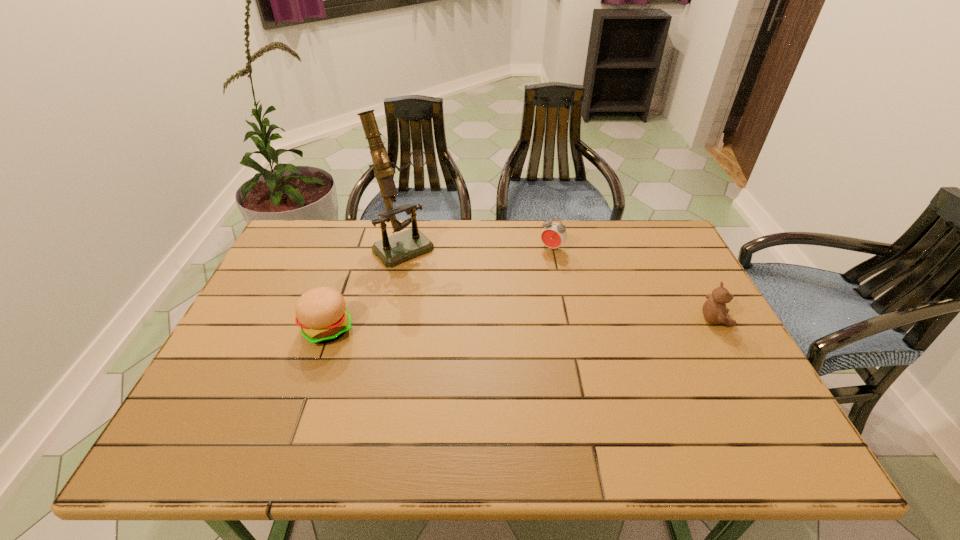
Where is `vacant space that's between the rightmost object and the second object from right to left`? vacant space that's between the rightmost object and the second object from right to left is located at coordinates (635, 284).

You are a GUI agent. You are given a task and a screenshot of the screen. Output one action in this format:
    pyautogui.click(x=<x>, y=<y>)
    Task: Click on the free area in between the microscope and the hamburger
    The height and width of the screenshot is (540, 960).
    Given the screenshot: What is the action you would take?
    pyautogui.click(x=366, y=287)

Where is `vacant space that is in between the tallest object and the hamburger`? vacant space that is in between the tallest object and the hamburger is located at coordinates [366, 287].

At what (x,y) coordinates should I click in order to perform the action: click on vacant space in between the hamburger and the third object from left to right. Please return your answer as a coordinate pair (x, y). Looking at the image, I should click on (441, 288).

Locate an element on the screen. Image resolution: width=960 pixels, height=540 pixels. vacant point located between the tallest object and the rightmost object is located at coordinates (560, 283).

In order to click on free space that is in between the hamburger and the microscope in this screenshot , I will do `click(366, 287)`.

Image resolution: width=960 pixels, height=540 pixels. I want to click on vacant area that lies between the second object from right to left and the teddy bear, so click(x=635, y=284).

Locate an element on the screen. free space that is in between the alarm clock and the hamburger is located at coordinates (441, 288).

Identify the location of vacant space that's between the tallest object and the hamburger. (366, 287).

The image size is (960, 540). Identify the location of vacant area that lies between the hamburger and the third object from left to right. (441, 288).